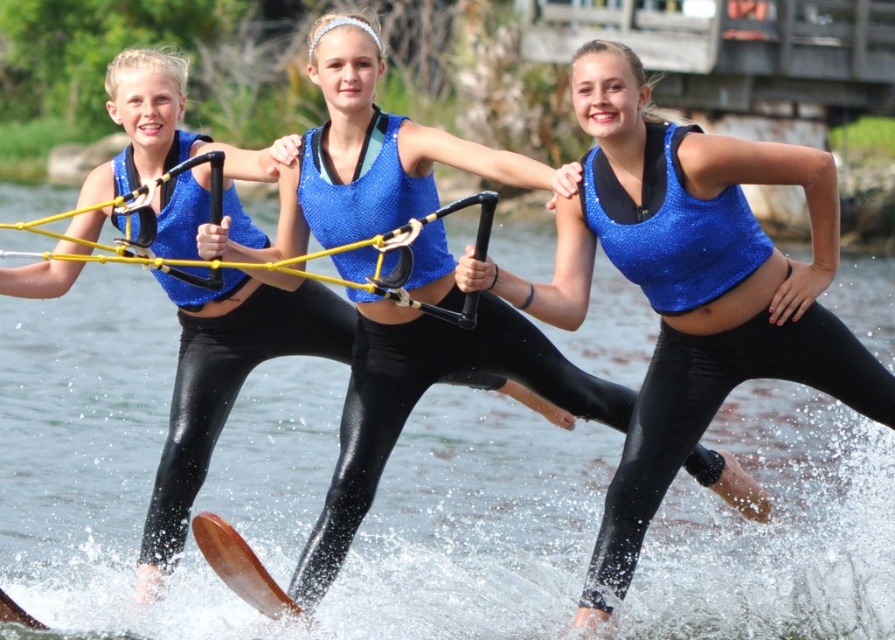
From the picture: Which is more to the right, black matte wetsuit at center or yellow rubber rope at center?

black matte wetsuit at center

Who is positioned more to the left, black matte wetsuit at center or yellow rubber rope at center?

yellow rubber rope at center is more to the left.

The width and height of the screenshot is (895, 640). What do you see at coordinates (419, 396) in the screenshot? I see `black matte wetsuit at center` at bounding box center [419, 396].

Locate an element on the screen. black matte wetsuit at center is located at coordinates (419, 396).

In the scene shown: Which of these two, shiny blue fabric at center or yellow rubber rope at center, stands taller?

shiny blue fabric at center

Who is positioned more to the left, shiny blue fabric at center or yellow rubber rope at center?

From the viewer's perspective, yellow rubber rope at center appears more on the left side.

The image size is (895, 640). What are the coordinates of `shiny blue fabric at center` in the screenshot? It's located at (718, 406).

Can you confirm if clear water at center is shorter than brown wooden water ski at lower left?

No.

Where is `clear water at center`? The image size is (895, 640). clear water at center is located at coordinates (355, 534).

Is point (737, 545) in front of point (224, 528)?

That is False.

Identify the location of clear water at center. The width and height of the screenshot is (895, 640). (355, 534).